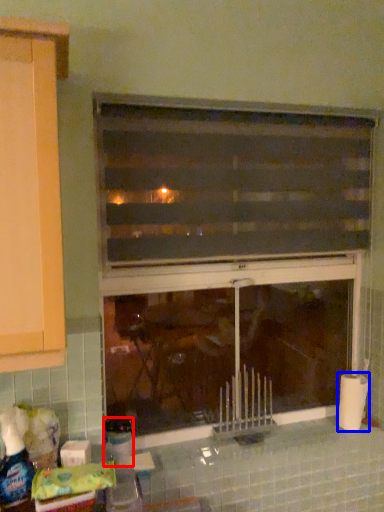
Question: Which of the following is the closest to the observer, bottle (highlighted by a red box) or toilet paper (highlighted by a blue box)?

Choices:
 (A) bottle
 (B) toilet paper

Answer: (A)